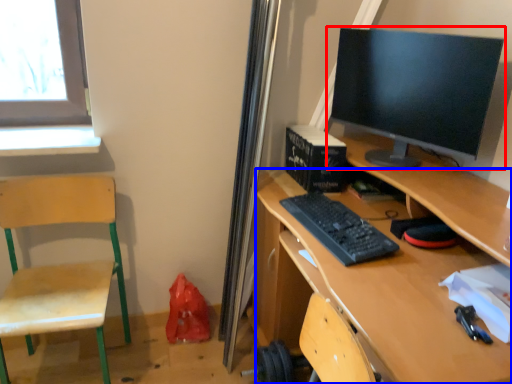
Question: Which object appears farthest to the camera in this image, computer monitor (highlighted by a red box) or desk (highlighted by a blue box)?

Choices:
 (A) computer monitor
 (B) desk

Answer: (A)